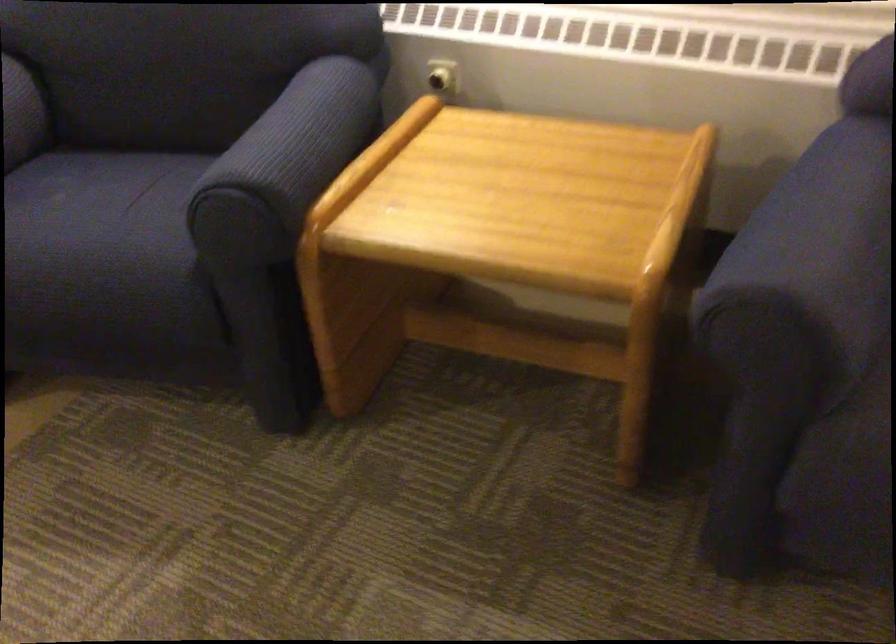
At what (x,y) coordinates should I click in order to perform the action: click on blue chair sitting surface. Please return your answer as a coordinate pair (x, y). This screenshot has width=896, height=644. Looking at the image, I should click on (99, 232).